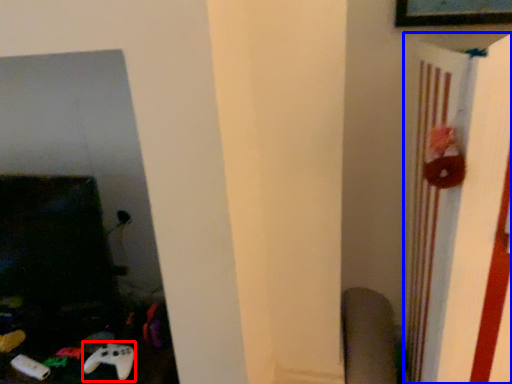
Question: Which object is closer to the camera taking this photo, game controller (highlighted by a red box) or bulletin board (highlighted by a blue box)?

Choices:
 (A) game controller
 (B) bulletin board

Answer: (B)